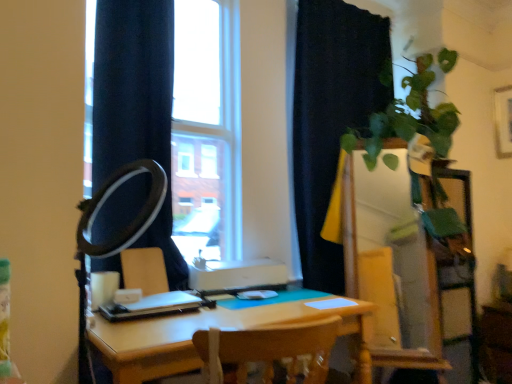
Question: Is matte white armchair at center in contact with black matte curtain at upper right?

Choices:
 (A) no
 (B) yes

Answer: (A)

Question: Is matte white armchair at center behind black matte curtain at upper right?

Choices:
 (A) yes
 (B) no

Answer: (B)

Question: Is matte white armchair at center shorter than black matte curtain at upper right?

Choices:
 (A) no
 (B) yes

Answer: (B)

Question: Is matte white armchair at center looking in the opposite direction of black matte curtain at upper right?

Choices:
 (A) yes
 (B) no

Answer: (B)

Question: Does matte white armchair at center appear on the left side of black matte curtain at upper right?

Choices:
 (A) no
 (B) yes

Answer: (B)

Question: Relative to black matte ring light at left, is light brown wooden table at center in front or behind?

Choices:
 (A) behind
 (B) front

Answer: (A)

Question: Do you think light brown wooden table at center is within black matte ring light at left, or outside of it?

Choices:
 (A) outside
 (B) inside

Answer: (A)

Question: From a real-world perspective, relative to black matte ring light at left, is light brown wooden table at center vertically above or below?

Choices:
 (A) above
 (B) below

Answer: (B)

Question: Considering the positions of light brown wooden table at center and black matte ring light at left in the image, is light brown wooden table at center wider or thinner than black matte ring light at left?

Choices:
 (A) thin
 (B) wide

Answer: (B)

Question: Is green glossy dresser at right bigger or smaller than black matte ring light at left?

Choices:
 (A) small
 (B) big

Answer: (B)

Question: Choose the correct answer: Is green glossy dresser at right inside black matte ring light at left or outside it?

Choices:
 (A) outside
 (B) inside

Answer: (A)

Question: Would you say green glossy dresser at right is to the left or to the right of black matte ring light at left in the picture?

Choices:
 (A) left
 (B) right

Answer: (B)

Question: Is point (349, 215) positioned closer to the camera than point (80, 268)?

Choices:
 (A) farther
 (B) closer

Answer: (A)

Question: Which is correct: black matte ring light at left is inside black matte curtain at upper right, or outside of it?

Choices:
 (A) inside
 (B) outside

Answer: (B)

Question: From the image's perspective, is black matte ring light at left above or below black matte curtain at upper right?

Choices:
 (A) below
 (B) above

Answer: (A)